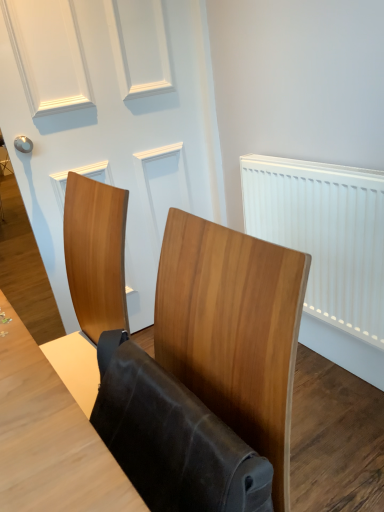
Question: In terms of width, does wooden chair at center look wider or thinner when compared to white plastic radiator at right?

Choices:
 (A) wide
 (B) thin

Answer: (A)

Question: Is point (x=261, y=302) closer or farther from the camera than point (x=374, y=186)?

Choices:
 (A) farther
 (B) closer

Answer: (B)

Question: Estimate the real-world distances between objects in this image. Which object is closer to the white matte door at upper center?

Choices:
 (A) wooden chair at center
 (B) leather-like brown folding chair at center
 (C) white plastic radiator at right

Answer: (C)

Question: Which object is the closest to the white matte door at upper center?

Choices:
 (A) wooden chair at center
 (B) white plastic radiator at right
 (C) leather-like brown folding chair at center

Answer: (B)